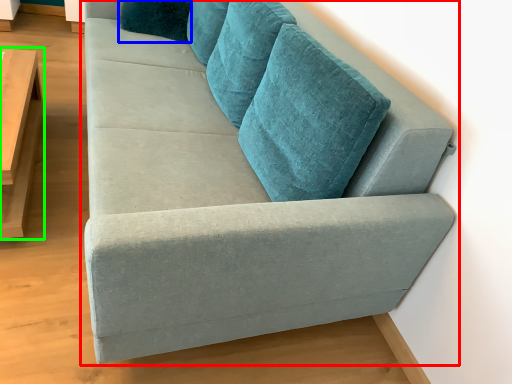
Question: Based on their relative distances, which object is farther from studio couch (highlighted by a red box)? Choose from pillow (highlighted by a blue box) and table (highlighted by a green box).

Choices:
 (A) pillow
 (B) table

Answer: (A)